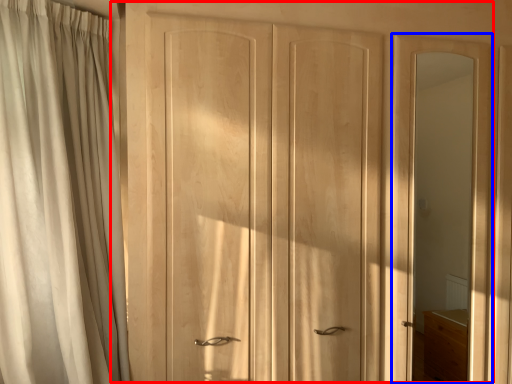
Question: Which object appears closest to the camera in this image, door (highlighted by a red box) or screen door (highlighted by a blue box)?

Choices:
 (A) door
 (B) screen door

Answer: (A)